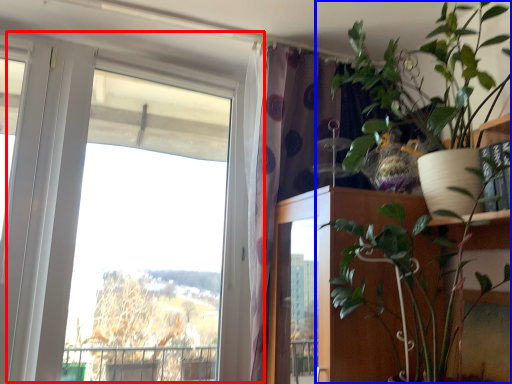
Question: Which object appears closest to the camera in this image, window (highlighted by a red box) or houseplant (highlighted by a blue box)?

Choices:
 (A) window
 (B) houseplant

Answer: (B)